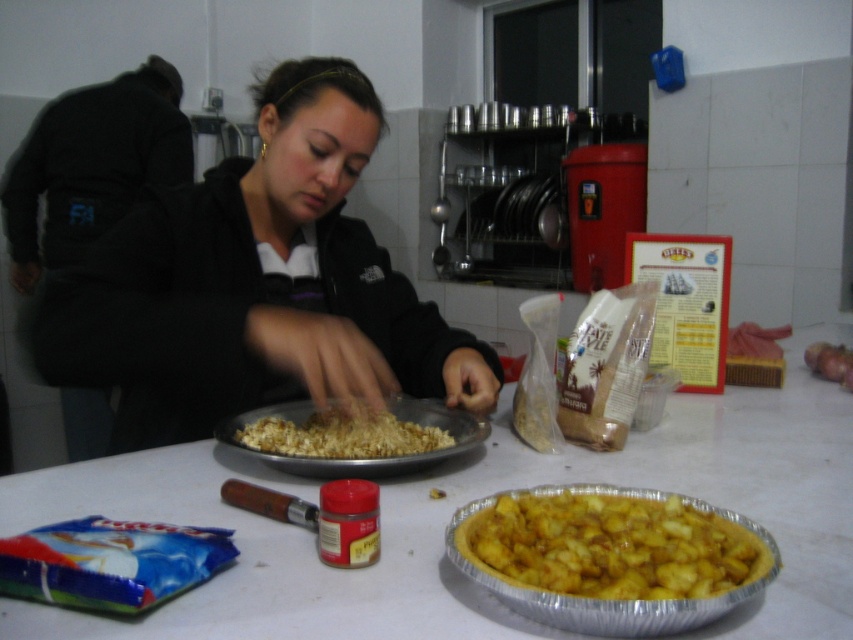
Is golden crumbly pie at center positioned at the back of golden crunchy popcorn at center?

No, it is in front of golden crunchy popcorn at center.

Is golden crumbly pie at center positioned before golden crunchy popcorn at center?

Yes, golden crumbly pie at center is closer to the viewer.

Where is `golden crumbly pie at center`? golden crumbly pie at center is located at coordinates (610, 547).

The image size is (853, 640). Identify the location of golden crumbly pie at center. (610, 547).

Is white matte table at center shorter than golden crunchy popcorn at center?

Incorrect, white matte table at center's height does not fall short of golden crunchy popcorn at center's.

Can you confirm if white matte table at center is positioned below golden crunchy popcorn at center?

No.

This screenshot has width=853, height=640. In order to click on white matte table at center in this screenshot , I will do `click(463, 502)`.

Identify the location of white matte table at center. (463, 502).

What do you see at coordinates (463, 502) in the screenshot? I see `white matte table at center` at bounding box center [463, 502].

The width and height of the screenshot is (853, 640). Find the location of `white matte table at center`. white matte table at center is located at coordinates (463, 502).